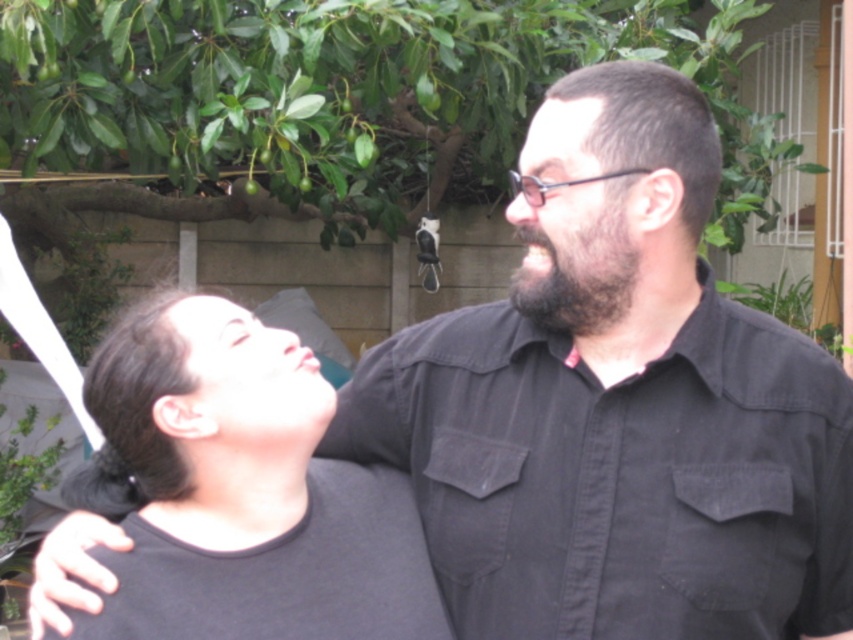
Question: Among these objects, which one is nearest to the camera?

Choices:
 (A) dark brown fuzzy beard at center
 (B) black cotton shirt at center
 (C) dark gray shirt at center

Answer: (B)

Question: Among these points, which one is nearest to the camera?

Choices:
 (A) (602, 317)
 (B) (814, 499)

Answer: (B)

Question: Can you confirm if black cotton shirt at center is bigger than dark brown fuzzy beard at center?

Choices:
 (A) no
 (B) yes

Answer: (B)

Question: Does dark gray shirt at center have a lesser width compared to dark brown fuzzy beard at center?

Choices:
 (A) yes
 (B) no

Answer: (B)

Question: Can you confirm if black cotton shirt at center is wider than dark gray shirt at center?

Choices:
 (A) no
 (B) yes

Answer: (B)

Question: Which object is closer to the camera taking this photo?

Choices:
 (A) dark gray shirt at center
 (B) dark brown fuzzy beard at center
 (C) black cotton shirt at center

Answer: (C)